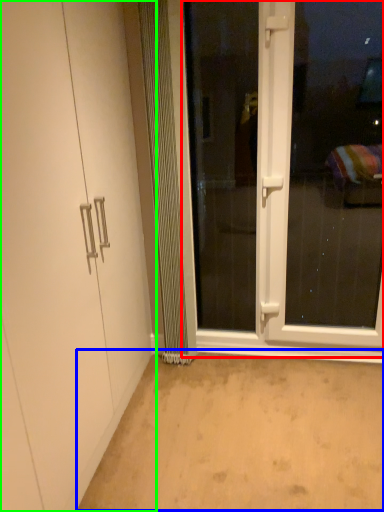
Question: Which object is the closest to the screen door (highlighted by a red box)? Choose among these: plain (highlighted by a blue box) or door (highlighted by a green box).

Choices:
 (A) plain
 (B) door

Answer: (A)